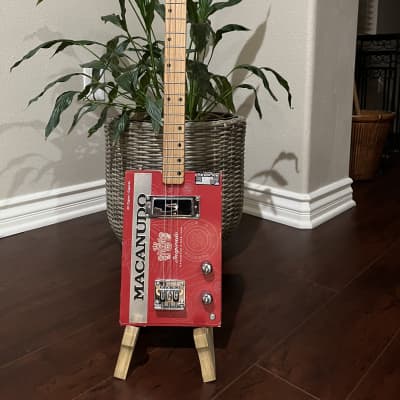
This screenshot has width=400, height=400. I want to click on outlet, so click(88, 78).